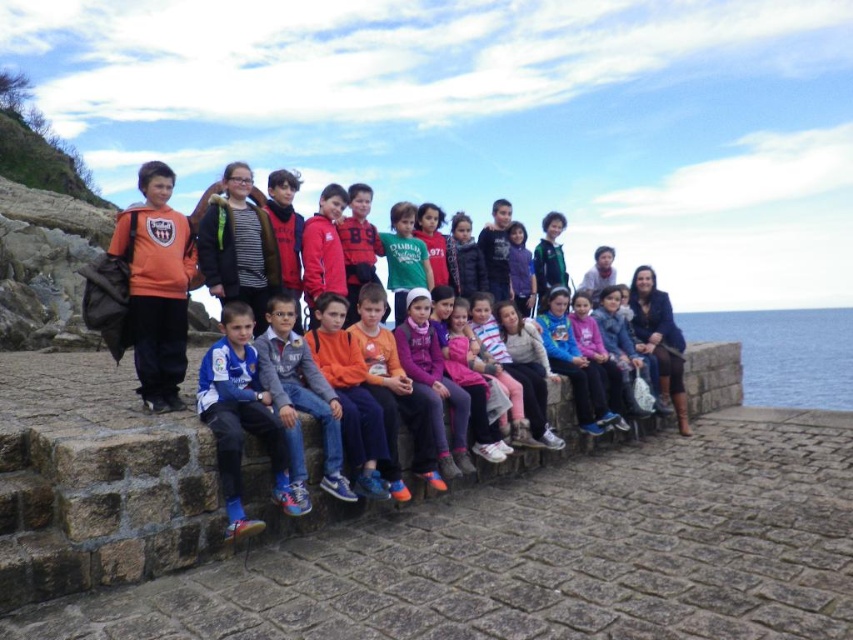
Question: Can you confirm if orange fleece jacket at left is positioned to the right of blue water at lower right?

Choices:
 (A) yes
 (B) no

Answer: (B)

Question: Does orange fleece jacket at left have a greater width compared to blue water at lower right?

Choices:
 (A) yes
 (B) no

Answer: (B)

Question: Which object is closer to the camera taking this photo?

Choices:
 (A) blue water at lower right
 (B) orange fleece jacket at left

Answer: (B)

Question: Which of the following is the closest to the observer?

Choices:
 (A) (137, 316)
 (B) (846, 330)

Answer: (A)

Question: Can you confirm if orange fleece jacket at left is positioned above blue water at lower right?

Choices:
 (A) no
 (B) yes

Answer: (B)